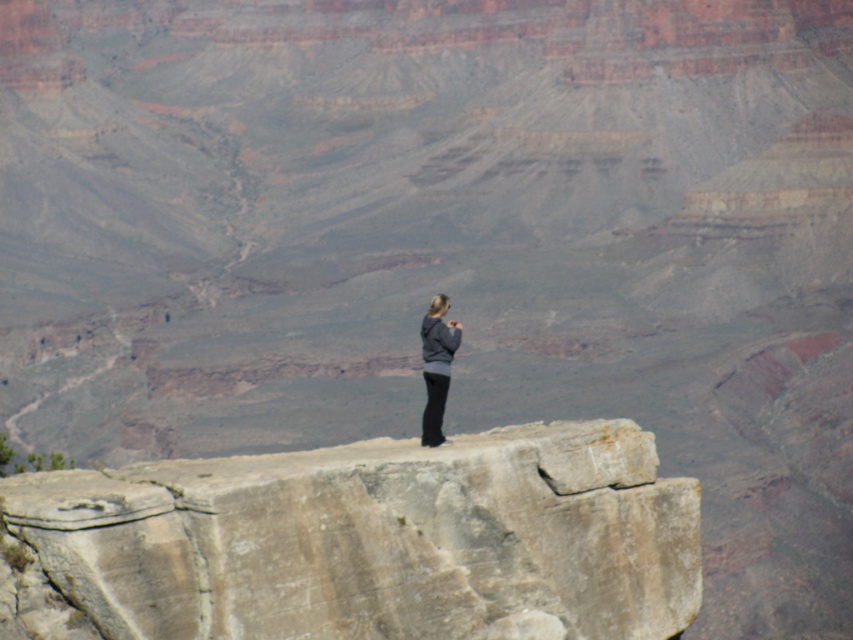
In the scene shown: You are a hiker who wants to take a photo of the rustic stone cliff at center from a distance of 40 meters. Can you do so while standing on the rocky outcrop in the foreground?

The distance between you and the rustic stone cliff at center is 38.80 meters, which is less than 40 meters. Therefore, you can take the photo while standing on the rocky outcrop in the foreground.

You are standing at the edge of the Grand Canyon and see two points marked in the image. The first point is at coordinates point (621,460) and the second is at point (442,323). Which point is physically closer to you?

Point (621,460) is closer to the camera than point (442,323), so the first point is physically closer to you.

You are a hiker planning to take a photo of the rustic stone cliff at center from the rocky outcrop where the person is standing. Considering the cliff is at coordinates point 0.848, 0.424, will you be able to frame the entire cliff within your camera view if your camera has a standard 50mm lens?

The rustic stone cliff at center is located at point (361,541), so using a standard 50mm lens from the current position should allow you to frame the entire cliff within your camera view as the coordinates indicate it is centered and within a typical field of view.